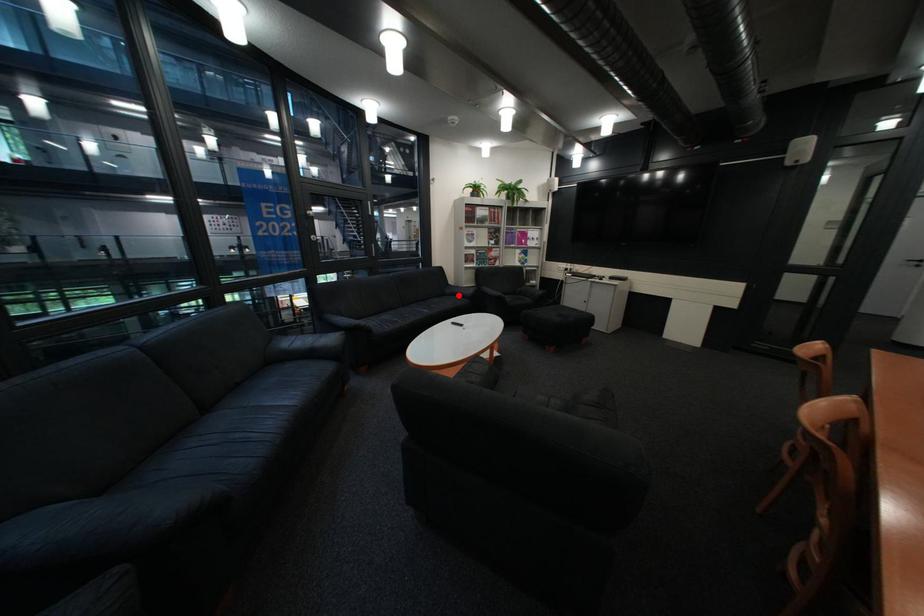
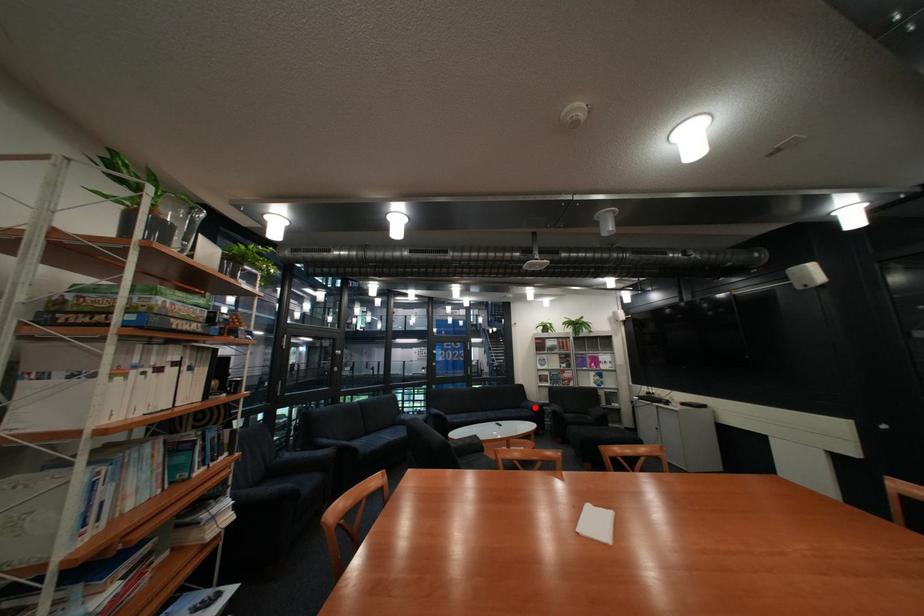
I am providing you with two images of the same scene from different viewpoints. A red point is marked on the first image and another point is marked on the second image. Is the marked point in image1 the same physical position as the marked point in image2?

Yes